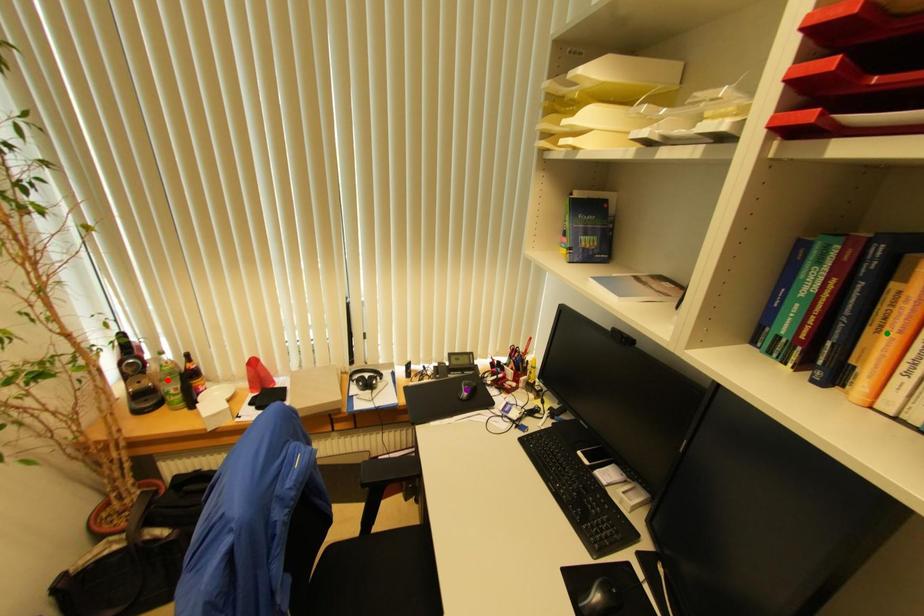
Order these from nearest to farthest:
red point
green point
purple point

1. green point
2. red point
3. purple point